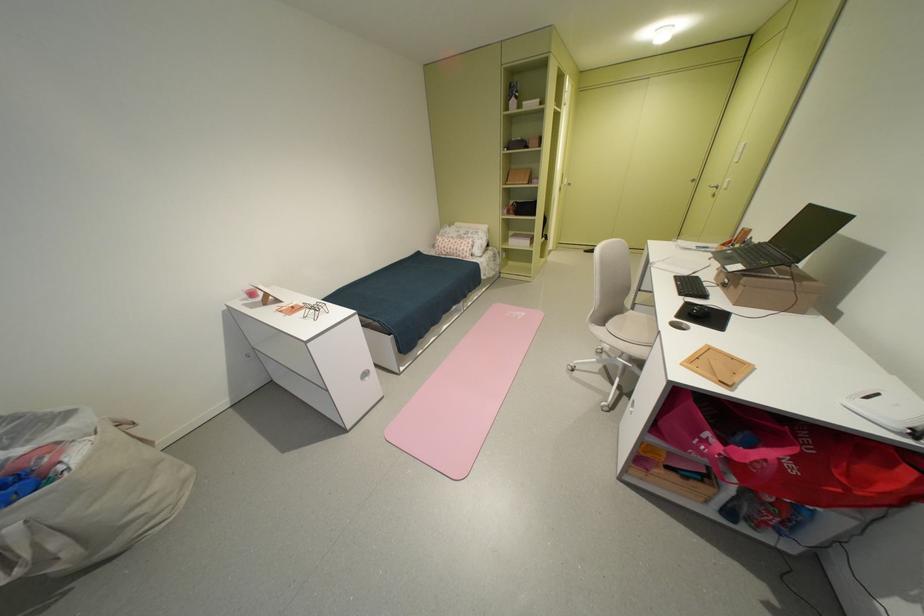
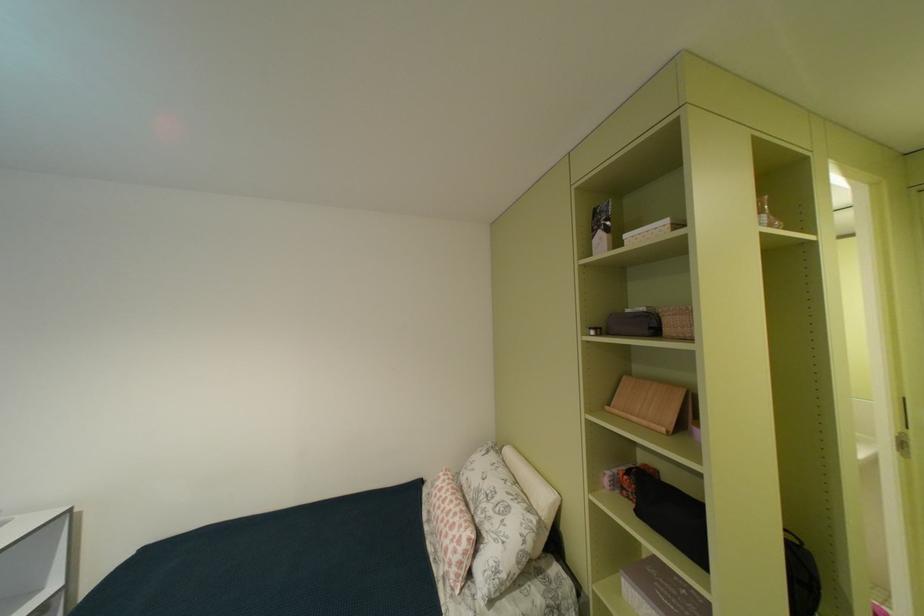
The point at (540, 147) is marked in the first image. Where is the corresponding point in the second image?

(675, 331)